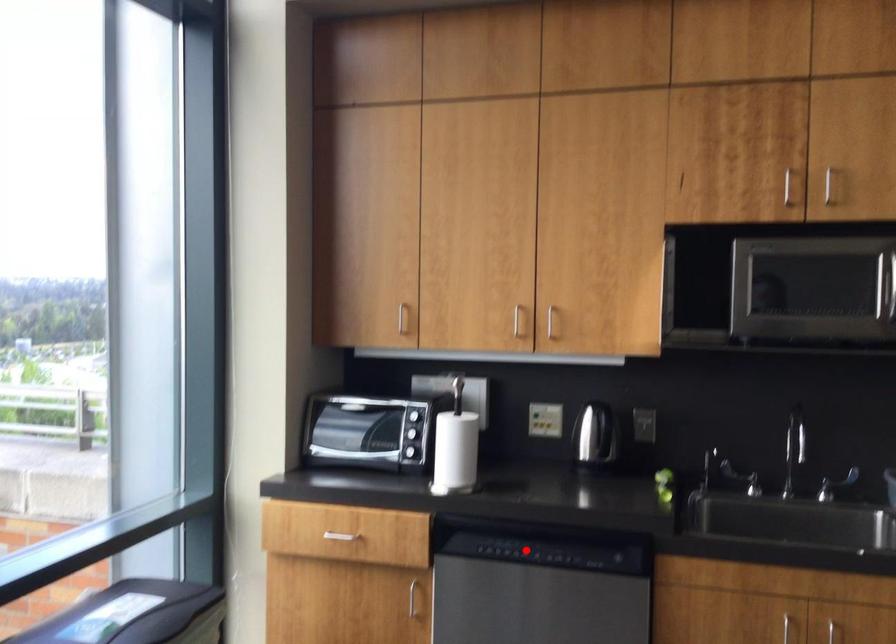
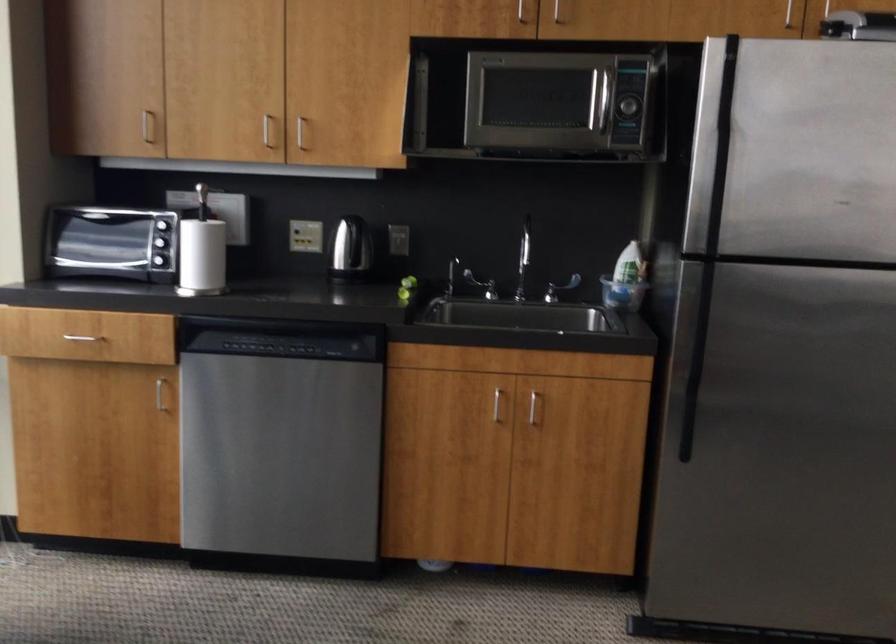
In the second image, find the point that corresponds to the highlighted location in the first image.

(277, 346)